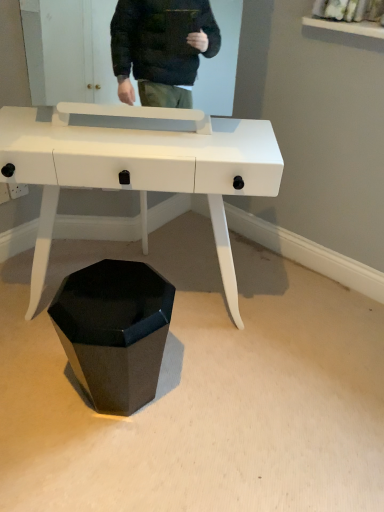
The height and width of the screenshot is (512, 384). In order to click on vacant space that is to the left of glossy black hexagonal at lower center in this screenshot , I will do `click(39, 389)`.